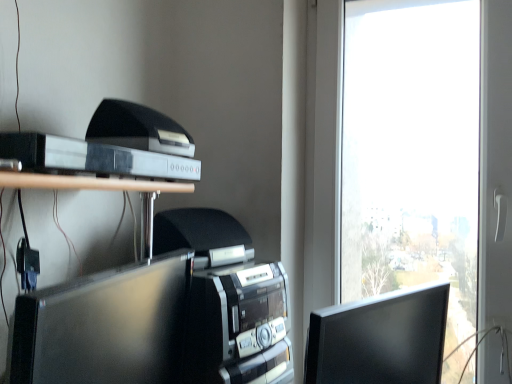
Question: From a real-world perspective, is matte black monitor at right, the first computer monitor positioned from the right, positioned above or below matte black monitor at center, marked as the second computer monitor in a right-to-left arrangement?

Choices:
 (A) above
 (B) below

Answer: (B)

Question: Looking at the image, does matte black monitor at right, the first computer monitor positioned from the right, seem bigger or smaller compared to matte black monitor at center, marked as the second computer monitor in a right-to-left arrangement?

Choices:
 (A) small
 (B) big

Answer: (A)

Question: Which is farther from the matte black monitor at right, the first computer monitor positioned from the right?

Choices:
 (A) matte black monitor at center, marked as the second computer monitor in a right-to-left arrangement
 (B) black plastic printer at upper left

Answer: (B)

Question: Estimate the real-world distances between objects in this image. Which object is farther from the black plastic printer at upper left?

Choices:
 (A) matte black monitor at center, marked as the second computer monitor in a right-to-left arrangement
 (B) matte black monitor at right, the first computer monitor positioned from the right

Answer: (B)